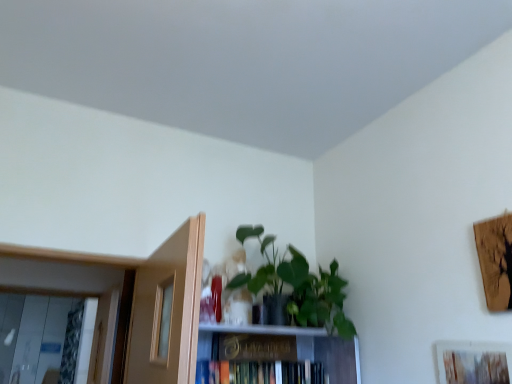
Question: Should I look upward or downward to see gold metallic paperback book at center?

Choices:
 (A) up
 (B) down

Answer: (B)

Question: Does gold metallic paperback book at center appear on the right side of green matte plant at upper center?

Choices:
 (A) yes
 (B) no

Answer: (B)

Question: Is gold metallic paperback book at center smaller than green matte plant at upper center?

Choices:
 (A) no
 (B) yes

Answer: (B)

Question: Is green matte plant at upper center inside gold metallic paperback book at center?

Choices:
 (A) yes
 (B) no

Answer: (B)

Question: From a real-world perspective, does gold metallic paperback book at center stand above green matte plant at upper center?

Choices:
 (A) no
 (B) yes

Answer: (A)

Question: From the image's perspective, is gold metallic paperback book at center located beneath green matte plant at upper center?

Choices:
 (A) yes
 (B) no

Answer: (A)

Question: Does gold metallic paperback book at center appear on the left side of green matte plant at upper center?

Choices:
 (A) no
 (B) yes

Answer: (B)

Question: Does wooden textured picture frame at lower right lie in front of hardcover book at center?

Choices:
 (A) no
 (B) yes

Answer: (B)

Question: Is wooden textured picture frame at lower right next to hardcover book at center?

Choices:
 (A) no
 (B) yes

Answer: (A)

Question: From a real-world perspective, does wooden textured picture frame at lower right stand above hardcover book at center?

Choices:
 (A) no
 (B) yes

Answer: (B)

Question: Could you tell me if wooden textured picture frame at lower right is turned towards hardcover book at center?

Choices:
 (A) no
 (B) yes

Answer: (A)

Question: Is wooden textured picture frame at lower right not close to hardcover book at center?

Choices:
 (A) yes
 (B) no

Answer: (B)

Question: Could hardcover book at center be considered to be inside wooden textured picture frame at lower right?

Choices:
 (A) no
 (B) yes

Answer: (A)

Question: From a real-world perspective, is green matte plant at upper center located higher than hardcover book at center?

Choices:
 (A) yes
 (B) no

Answer: (A)